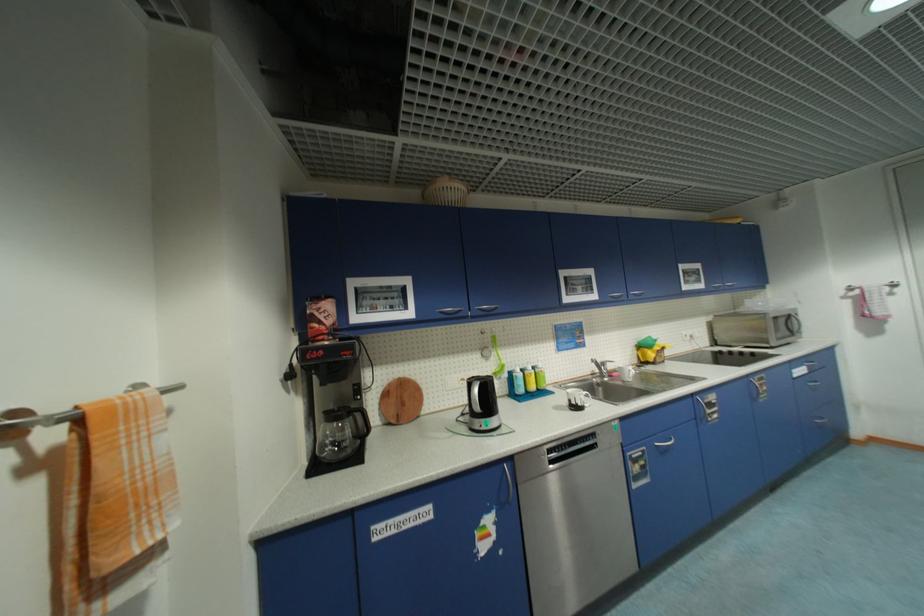
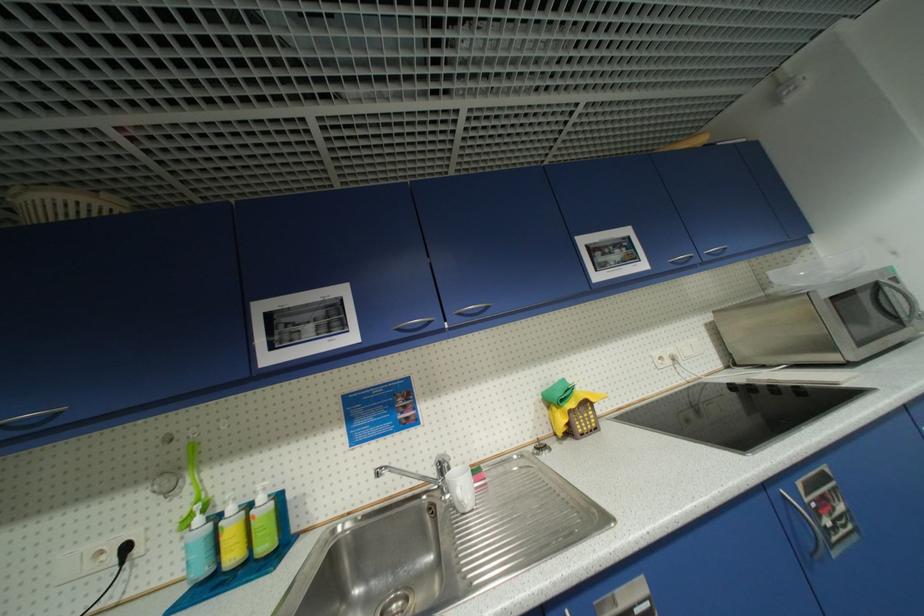
The point at (616, 297) is marked in the first image. Where is the corresponding point in the second image?

(405, 331)